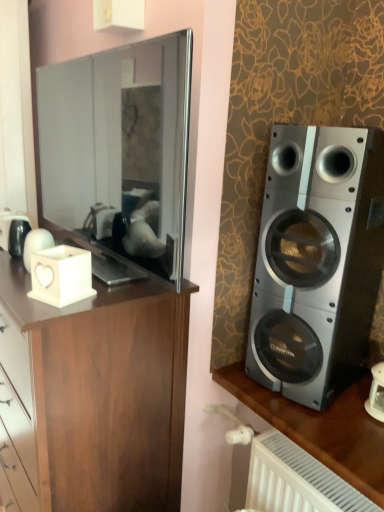
This screenshot has width=384, height=512. Find the location of `vacant space situated on the left part of white matte candle holder at left`. vacant space situated on the left part of white matte candle holder at left is located at coordinates (14, 287).